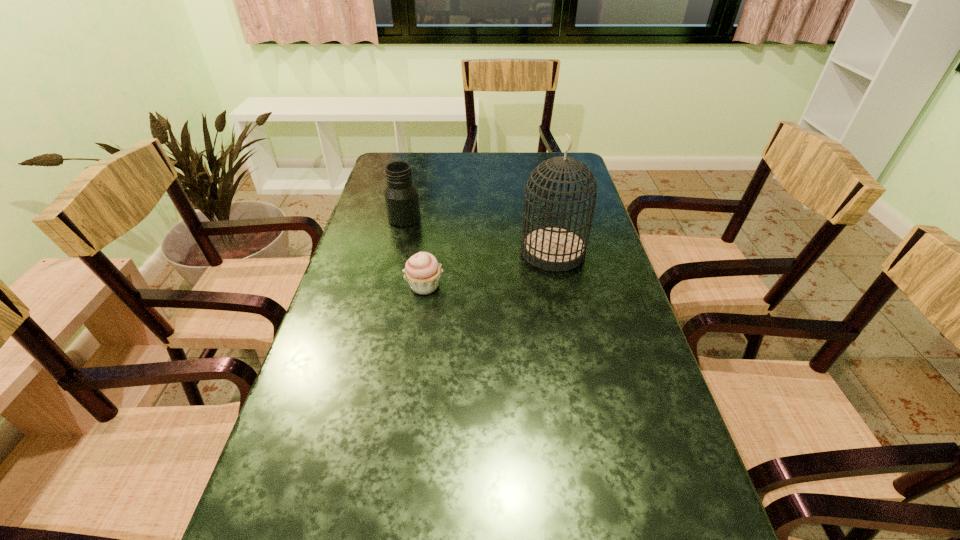
The width and height of the screenshot is (960, 540). Identify the location of object that is at the right edge. (550, 247).

Locate an element on the screen. The image size is (960, 540). free space at the far edge of the desktop is located at coordinates (453, 170).

Locate an element on the screen. vacant space at the left edge of the desktop is located at coordinates (372, 208).

Identify the location of vacant space at the right edge of the desktop. (650, 401).

Locate an element on the screen. The image size is (960, 540). free space at the far right corner is located at coordinates (563, 156).

Locate an element on the screen. Image resolution: width=960 pixels, height=540 pixels. blank region between the second shortest object and the rightmost object is located at coordinates (479, 234).

Where is `free space between the nearest object and the birdcage`? Image resolution: width=960 pixels, height=540 pixels. free space between the nearest object and the birdcage is located at coordinates (489, 268).

Where is `blank region between the shortest object and the jar`? This screenshot has width=960, height=540. blank region between the shortest object and the jar is located at coordinates (415, 252).

This screenshot has height=540, width=960. Find the location of `blank region between the jar and the nearest object`. blank region between the jar and the nearest object is located at coordinates (415, 252).

The width and height of the screenshot is (960, 540). I want to click on free space between the tallest object and the cupcake, so click(x=489, y=268).